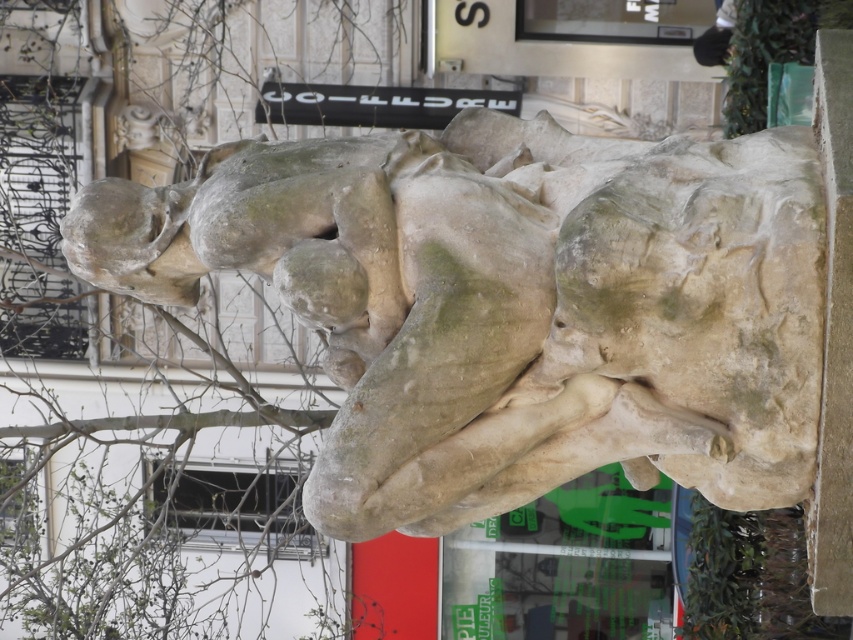
Question: Estimate the real-world distances between objects in this image. Which object is farther from the smooth stone head at center?

Choices:
 (A) stone head at upper left
 (B) stone statue at center

Answer: (A)

Question: Is stone head at upper left smaller than smooth stone head at center?

Choices:
 (A) no
 (B) yes

Answer: (A)

Question: Does stone statue at center appear over stone head at upper left?

Choices:
 (A) yes
 (B) no

Answer: (B)

Question: Which of the following is the farthest from the observer?

Choices:
 (A) stone statue at center
 (B) stone head at upper left
 (C) smooth stone head at center

Answer: (B)

Question: Does stone statue at center appear on the left side of smooth stone head at center?

Choices:
 (A) yes
 (B) no

Answer: (B)

Question: Which object is positioned farthest from the stone head at upper left?

Choices:
 (A) smooth stone head at center
 (B) stone statue at center

Answer: (B)